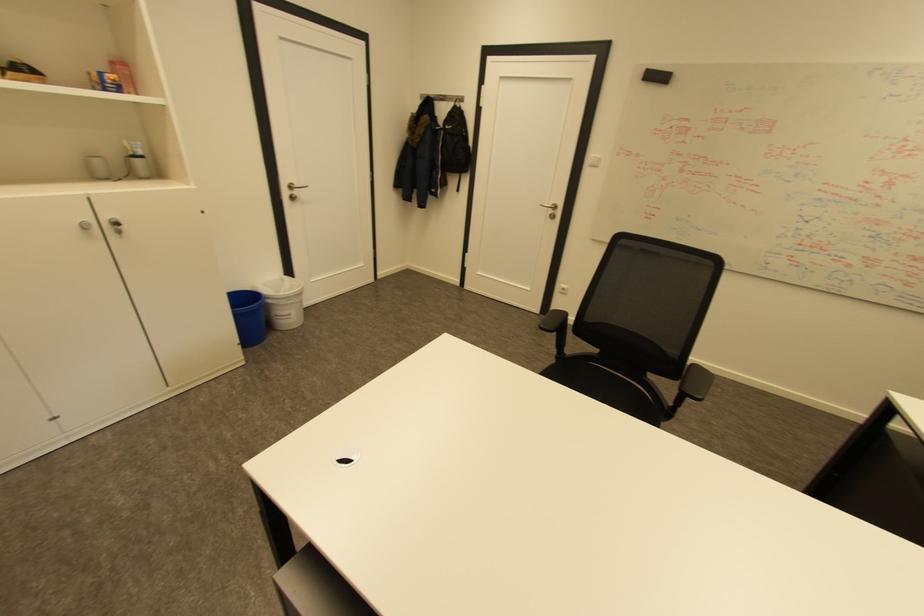
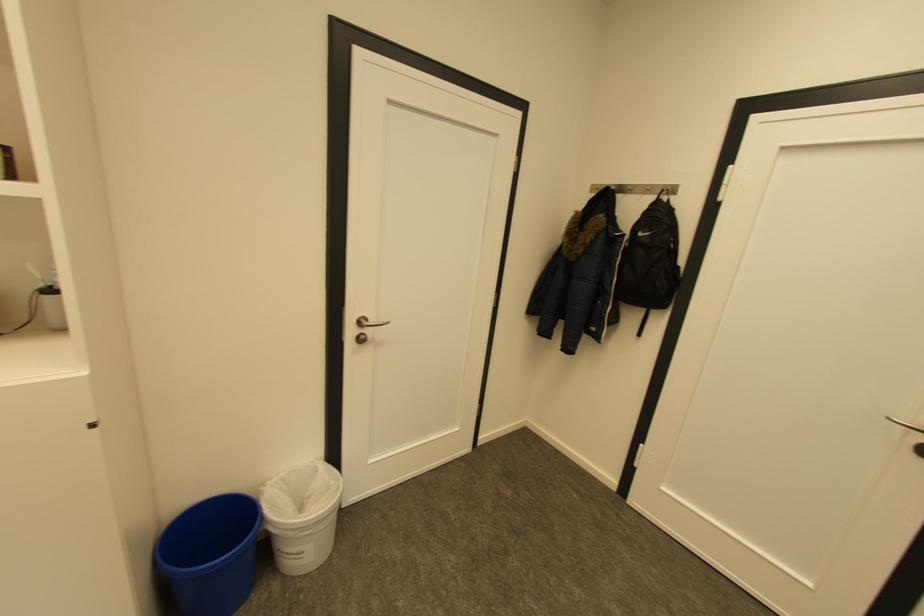
Where in the second image is the point corresponding to point (298, 187) from the first image?

(367, 323)